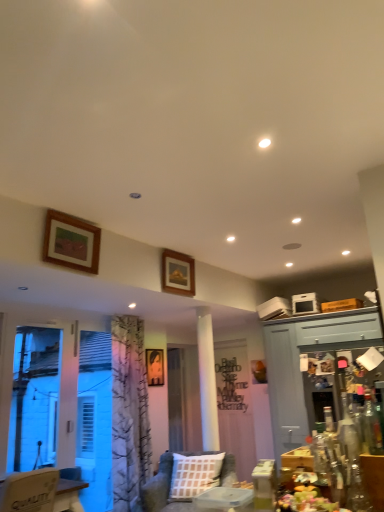
Question: Does point (44, 388) appear closer or farther from the camera than point (332, 381)?

Choices:
 (A) closer
 (B) farther

Answer: (A)

Question: From the image's perspective, is white plastic screen door at lower left, which appears as the 1th screen door when viewed from the left, located above or below metallic silver screen door at right, marked as the 1th screen door in a right-to-left arrangement?

Choices:
 (A) above
 (B) below

Answer: (A)

Question: Considering the real-world distances, which object is closest to the wooden chair at lower left?

Choices:
 (A) transparent plastic screen door at center, the fourth screen door positioned from the front
 (B) textured beige couch at center
 (C) transparent glass bottle at lower right
 (D) wooden table at lower right
 (E) white plastic screen door at lower left, positioned as the fourth screen door in back-to-front order

Answer: (B)

Question: Which is farther from the metallic silver screen door at right, marked as the 1th screen door in a right-to-left arrangement?

Choices:
 (A) wooden frame at upper left, which is the first picture frame from left to right
 (B) transparent plastic screen door at center, placed as the first screen door when sorted from back to front
 (C) wooden picture frame at upper center, the second picture frame when ordered from back to front
 (D) matte wooden picture frame at center, which is counted as the third picture frame, starting from the front
 (E) wooden chair at lower left

Answer: (E)